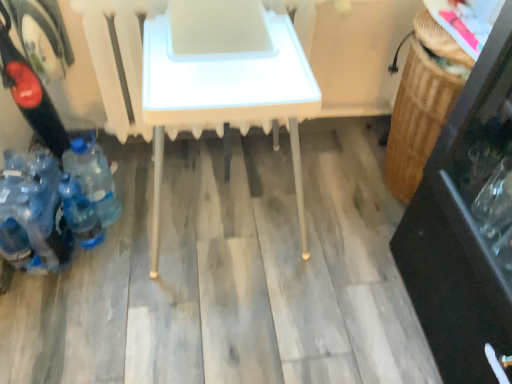
Image resolution: width=512 pixels, height=384 pixels. In order to click on vacant space to the right of blue plastic bottles at lower left, the 3th bottle positioned from the right in this screenshot , I will do `click(113, 259)`.